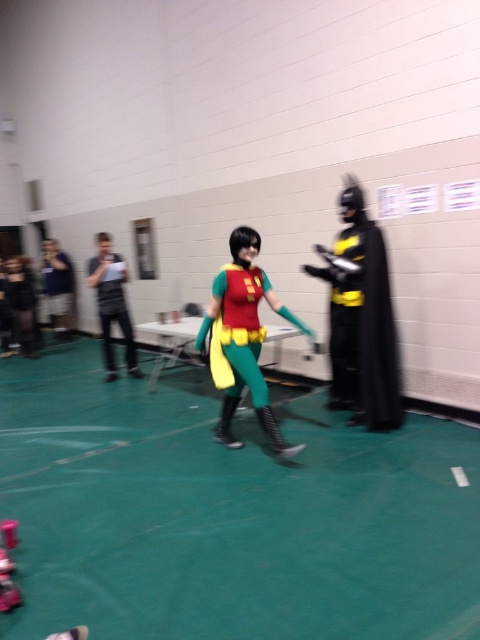
Question: Among these points, which one is farthest from the camera?

Choices:
 (A) (97, 275)
 (B) (67, 289)

Answer: (B)

Question: Does black matte batman costume at right lie behind matte green costume at center?

Choices:
 (A) yes
 (B) no

Answer: (A)

Question: Can you confirm if black matte batman costume at right is positioned to the left of matte green costume at center?

Choices:
 (A) no
 (B) yes

Answer: (A)

Question: Is black matte batman costume at right thinner than matte black camera at left?

Choices:
 (A) no
 (B) yes

Answer: (A)

Question: Which object appears closest to the camera in this image?

Choices:
 (A) matte black clipboard at left
 (B) black matte batman costume at right

Answer: (B)

Question: Which of the following is the farthest from the observer?

Choices:
 (A) (384, 355)
 (B) (98, 248)
 (C) (55, 276)

Answer: (C)